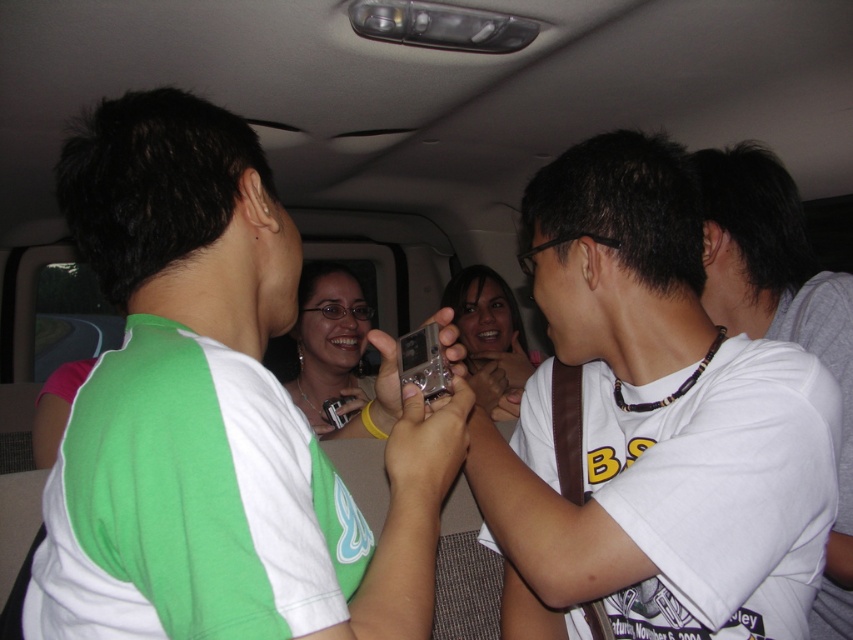
Based on the photo, you are a passenger in the car and want to hand the matte silver phone at center to the person wearing the green fabric shirt at center. Can you reach the phone without moving your current position?

The green fabric shirt at center is closer to the viewer than the matte silver phone at center, so you can reach the matte silver phone at center by extending your hand towards it since it is within arm

You are a photographer trying to capture a clear photo of the white matte shirt at center and the matte silver camera at center. The camera you are using has a depth of field that can focus clearly on objects within 20 inches. Will both objects be in focus?

The white matte shirt at center is 20.34 inches from matte silver camera at center. Since the depth of field can focus within 20 inches, the distance between them exceeds the focus range. Therefore, both objects may not be in focus simultaneously.